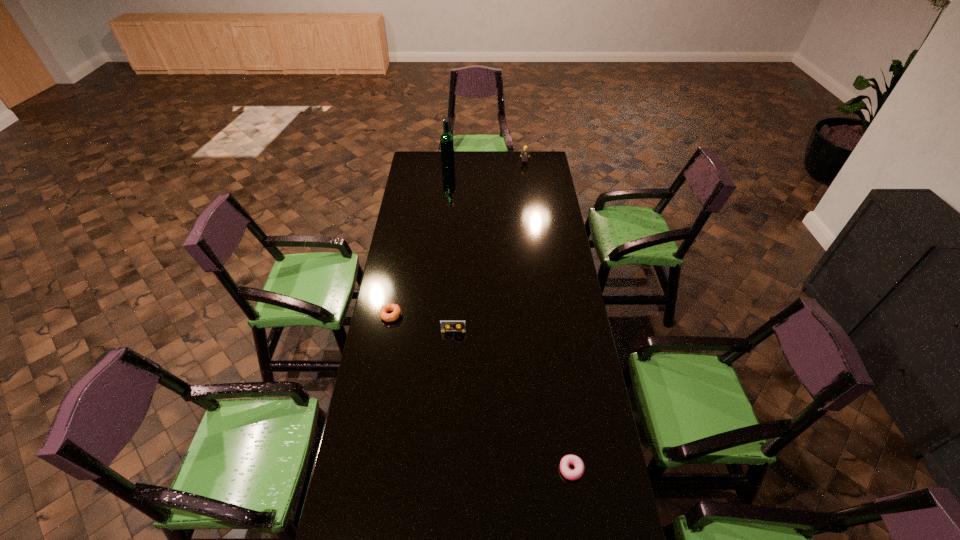
Where is `beer bottle`? Image resolution: width=960 pixels, height=540 pixels. beer bottle is located at coordinates (446, 139).

This screenshot has width=960, height=540. I want to click on the fourth shortest object, so click(524, 153).

This screenshot has width=960, height=540. I want to click on videotape, so pyautogui.click(x=458, y=326).

Locate an element on the screen. This screenshot has width=960, height=540. the fourth farthest object is located at coordinates (458, 326).

Locate an element on the screen. the fourth tallest object is located at coordinates (383, 312).

The height and width of the screenshot is (540, 960). I want to click on the leftmost object, so click(x=383, y=312).

Locate an element on the screen. The height and width of the screenshot is (540, 960). the shortest object is located at coordinates (566, 461).

Where is `the nearest object`? The height and width of the screenshot is (540, 960). the nearest object is located at coordinates (566, 461).

Where is `free space located 0.170m on the front of the tallest object`? The image size is (960, 540). free space located 0.170m on the front of the tallest object is located at coordinates (446, 185).

This screenshot has height=540, width=960. Identify the location of vacant space situated 0.150m in front of the second tallest object. (526, 175).